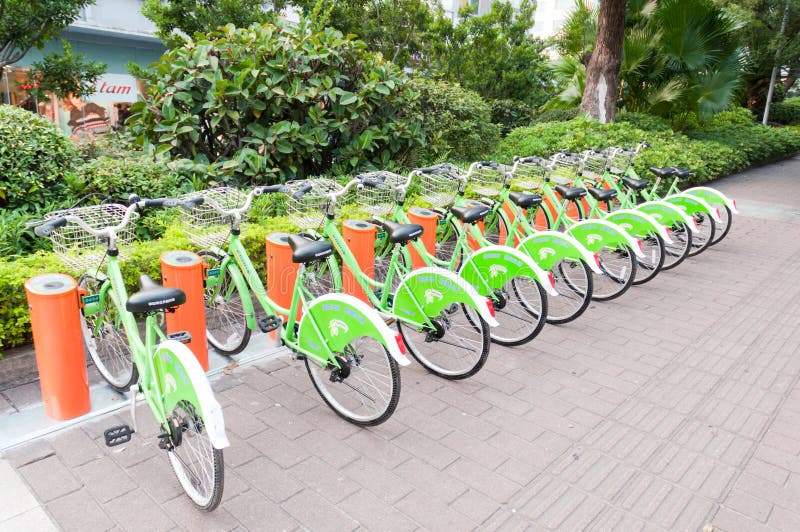
Find the location of a particular element. This screenshot has height=532, width=800. baskets is located at coordinates (98, 212), (204, 220), (304, 202), (376, 196), (440, 186), (484, 181), (526, 177), (564, 170), (596, 165), (620, 162).